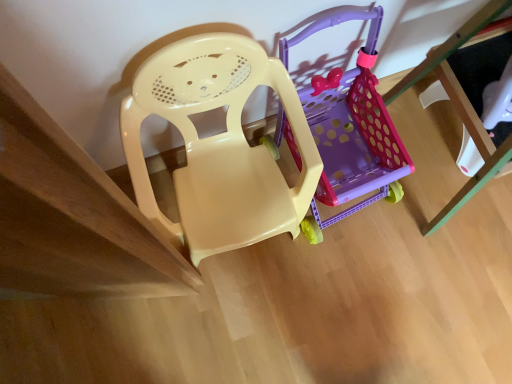
The image size is (512, 384). Describe the element at coordinates (218, 145) in the screenshot. I see `matte plastic chair at center` at that location.

Where is `matte plastic chair at center`? This screenshot has height=384, width=512. matte plastic chair at center is located at coordinates (218, 145).

Where is `translucent purple plastic shopping cart at center`? The height and width of the screenshot is (384, 512). translucent purple plastic shopping cart at center is located at coordinates (349, 127).

What do you see at coordinates (349, 127) in the screenshot?
I see `translucent purple plastic shopping cart at center` at bounding box center [349, 127].

What are the coordinates of `matte plastic chair at center` in the screenshot? It's located at (218, 145).

In the image, is translucent purple plastic shopping cart at center on the left side or the right side of matte plastic chair at center?

Based on their positions, translucent purple plastic shopping cart at center is located to the right of matte plastic chair at center.

Which object is closer to the camera, translucent purple plastic shopping cart at center or matte plastic chair at center?

Positioned in front is matte plastic chair at center.

Does point (380, 117) come closer to viewer compared to point (218, 234)?

No, (380, 117) is further to viewer.

In the scene shown: From the image's perspective, which is below, translucent purple plastic shopping cart at center or matte plastic chair at center?

matte plastic chair at center.

From a real-world perspective, is translucent purple plastic shopping cart at center positioned above or below matte plastic chair at center?

translucent purple plastic shopping cart at center is situated lower than matte plastic chair at center in the real world.

Which object is wider, translucent purple plastic shopping cart at center or matte plastic chair at center?

translucent purple plastic shopping cart at center.

Which of these two, translucent purple plastic shopping cart at center or matte plastic chair at center, stands shorter?

translucent purple plastic shopping cart at center is shorter.

Is translucent purple plastic shopping cart at center bigger than matte plastic chair at center?

Incorrect, translucent purple plastic shopping cart at center is not larger than matte plastic chair at center.

Is translucent purple plastic shopping cart at center positioned beyond the bounds of matte plastic chair at center?

translucent purple plastic shopping cart at center is positioned outside matte plastic chair at center.

Consider the image. Are translucent purple plastic shopping cart at center and matte plastic chair at center beside each other?

translucent purple plastic shopping cart at center and matte plastic chair at center are clearly separated.

Could you tell me if translucent purple plastic shopping cart at center is turned towards matte plastic chair at center?

No.

What's the angular difference between translucent purple plastic shopping cart at center and matte plastic chair at center's facing directions?

The angle between the facing direction of translucent purple plastic shopping cart at center and the facing direction of matte plastic chair at center is 1.21 degrees.

There is a translucent purple plastic shopping cart at center. Identify the location of chair above it (from a real-world perspective). (218, 145).

Is matte plastic chair at center to the left or to the right of translucent purple plastic shopping cart at center in the image?

From the image, it's evident that matte plastic chair at center is to the left of translucent purple plastic shopping cart at center.

Which is in front, matte plastic chair at center or translucent purple plastic shopping cart at center?

matte plastic chair at center is closer to the camera.

Considering the positions of point (252, 70) and point (375, 184), is point (252, 70) closer or farther from the camera than point (375, 184)?

Point (252, 70).

From the image's perspective, is matte plastic chair at center located above or below translucent purple plastic shopping cart at center?

Based on their image positions, matte plastic chair at center is located beneath translucent purple plastic shopping cart at center.

In the scene shown: From a real-world perspective, is matte plastic chair at center above or below translucent purple plastic shopping cart at center?

Clearly, from a real-world perspective, matte plastic chair at center is above translucent purple plastic shopping cart at center.

Does matte plastic chair at center have a lesser width compared to translucent purple plastic shopping cart at center?

Yes.

Between matte plastic chair at center and translucent purple plastic shopping cart at center, which one has less height?

translucent purple plastic shopping cart at center is shorter.

Is matte plastic chair at center bigger or smaller than translucent purple plastic shopping cart at center?

Considering their sizes, matte plastic chair at center takes up more space than translucent purple plastic shopping cart at center.

Is matte plastic chair at center located outside translucent purple plastic shopping cart at center?

Yes, matte plastic chair at center is outside of translucent purple plastic shopping cart at center.

Is matte plastic chair at center directly adjacent to translucent purple plastic shopping cart at center?

No, matte plastic chair at center is not beside translucent purple plastic shopping cart at center.

Is matte plastic chair at center aimed at translucent purple plastic shopping cart at center?

No.

How many degrees apart are the facing directions of matte plastic chair at center and translucent purple plastic shopping cart at center?

1.21 degrees separate the facing orientations of matte plastic chair at center and translucent purple plastic shopping cart at center.

Where is `chair that is below the translucent purple plastic shopping cart at center (from the image's perspective)`? The height and width of the screenshot is (384, 512). chair that is below the translucent purple plastic shopping cart at center (from the image's perspective) is located at coordinates click(218, 145).

Where is `chair on the left side of translucent purple plastic shopping cart at center`? This screenshot has height=384, width=512. chair on the left side of translucent purple plastic shopping cart at center is located at coordinates [218, 145].

The image size is (512, 384). I want to click on chair below the translucent purple plastic shopping cart at center (from the image's perspective), so click(218, 145).